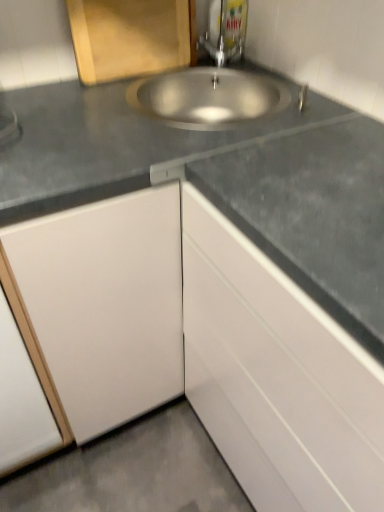
Question: Choose the correct answer: Is metallic faucet at upper center inside wooden cutting board at upper left, placed as the first cabinetry when sorted from top to bottom, or outside it?

Choices:
 (A) inside
 (B) outside

Answer: (B)

Question: Is metallic faucet at upper center in front of or behind wooden cutting board at upper left, positioned as the 2th cabinetry in bottom-to-top order, in the image?

Choices:
 (A) behind
 (B) front

Answer: (A)

Question: Estimate the real-world distances between objects in this image. Which object is farther from the white glossy cabinet at lower right, positioned as the 1th cabinetry in bottom-to-top order?

Choices:
 (A) metallic faucet at upper center
 (B) wooden cutting board at upper left, which ranks as the second cabinetry in right-to-left order

Answer: (A)

Question: Estimate the real-world distances between objects in this image. Which object is farther from the metallic faucet at upper center?

Choices:
 (A) white glossy cabinet at lower right, arranged as the second cabinetry when viewed from the left
 (B) wooden cutting board at upper left, which ranks as the second cabinetry in right-to-left order

Answer: (A)